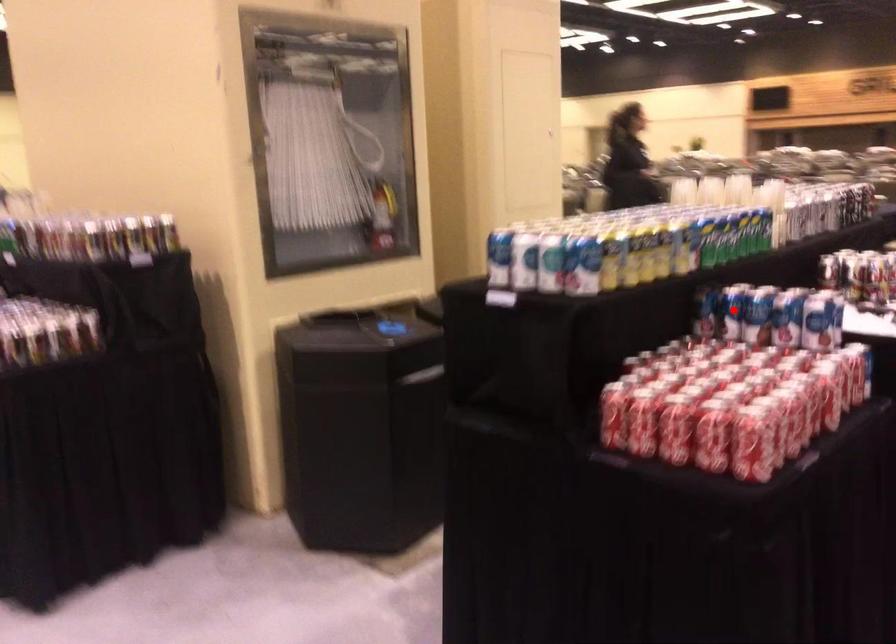
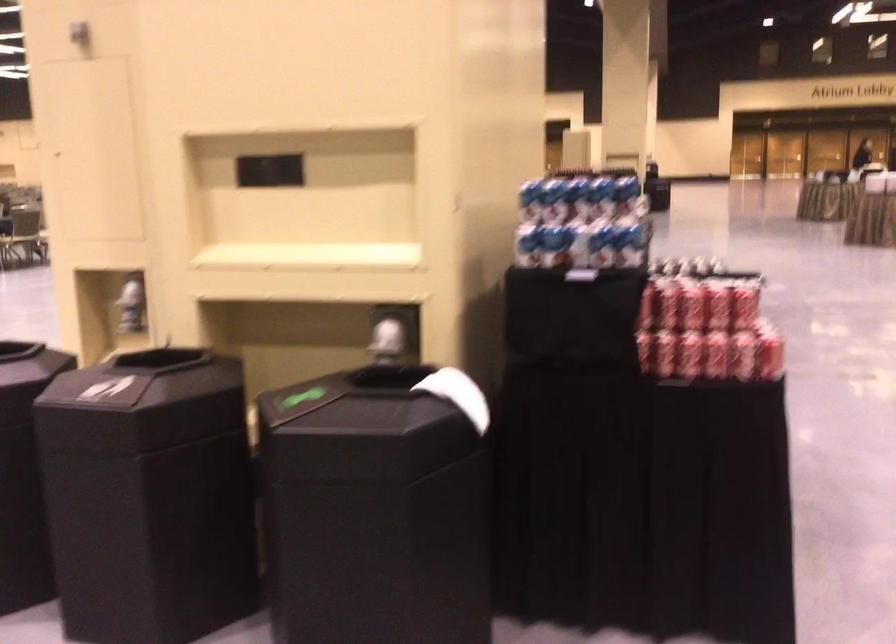
Question: I am providing you with two images of the same scene from different viewpoints. A red point is marked on the first image. Can you still see the location of the red point in image 2?

Choices:
 (A) Yes
 (B) No

Answer: (B)